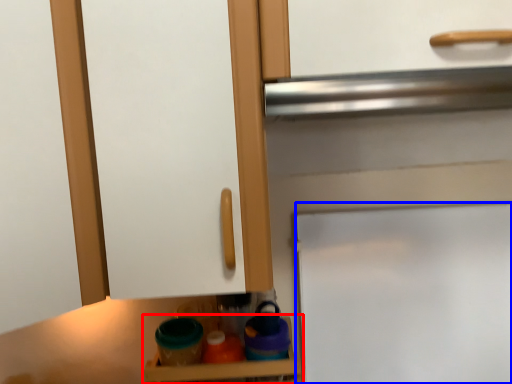
Question: Which object is closer to the camera taking this photo, shelf (highlighted by a red box) or door (highlighted by a blue box)?

Choices:
 (A) shelf
 (B) door

Answer: (A)